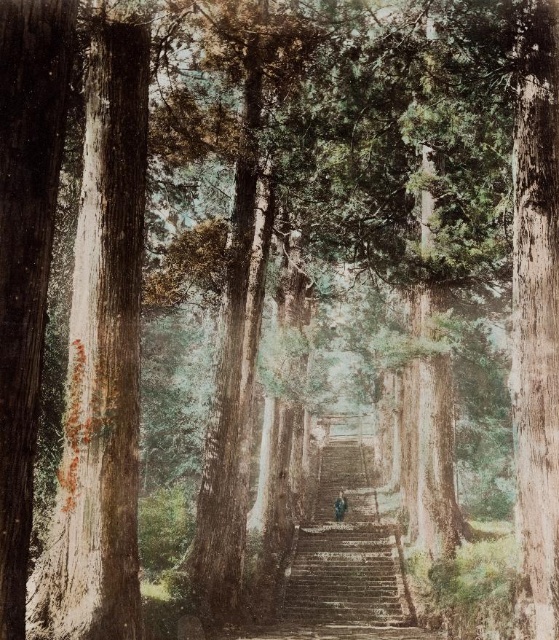
Question: Is smooth brown bark at left in front of brown leather jacket at center?

Choices:
 (A) yes
 (B) no

Answer: (A)

Question: Can you confirm if smooth brown bark at left is smaller than brown leather jacket at center?

Choices:
 (A) yes
 (B) no

Answer: (B)

Question: Does smooth brown bark at left have a larger size compared to brown leather jacket at center?

Choices:
 (A) yes
 (B) no

Answer: (A)